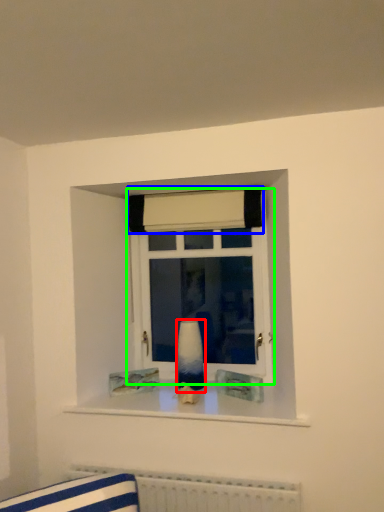
Question: Considering the real-world distances, which object is farthest from vase (highlighted by a red box)? curtain (highlighted by a blue box) or window (highlighted by a green box)?

Choices:
 (A) curtain
 (B) window

Answer: (A)